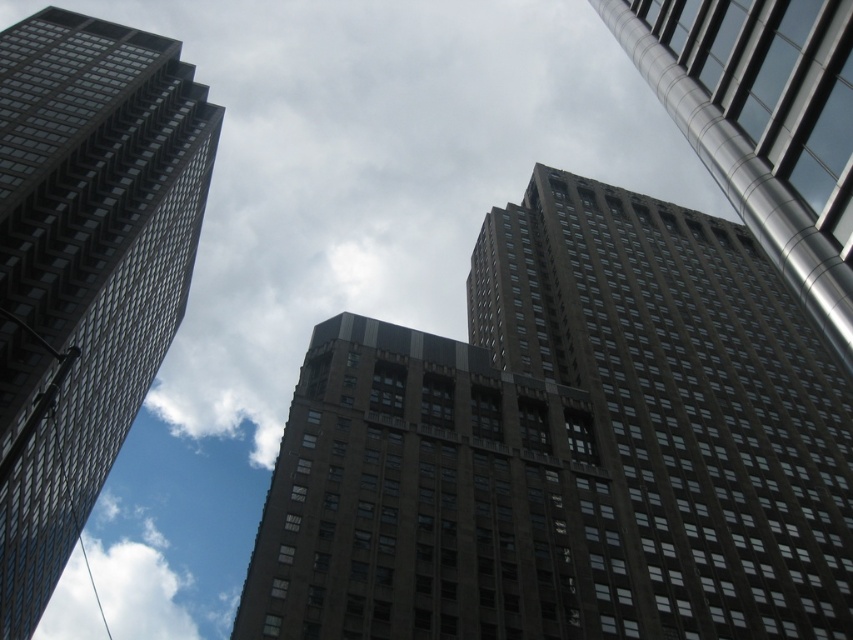
You are an architect analyzing the city skyline. You notice the brown stone building at upper center and the white fluffy cloud at lower left. Which object is taller in the scene?

The brown stone building at upper center has a lesser height compared to the white fluffy cloud at lower left, so the white fluffy cloud at lower left is taller.

You are standing on the street below and looking up at the buildings. Which object is more to the right between the brown stone building at upper center and the white fluffy cloud at lower left?

The brown stone building at upper center is more to the right than the white fluffy cloud at lower left.

You are standing on the ground floor of a building and looking up at the brown stone building at upper center and the polished silver tower at upper right. Which one is positioned more to the left from your viewpoint?

The polished silver tower at upper right is positioned more to the left than the brown stone building at upper center because the brown stone building at upper center is to the right of the polished silver tower at upper right.